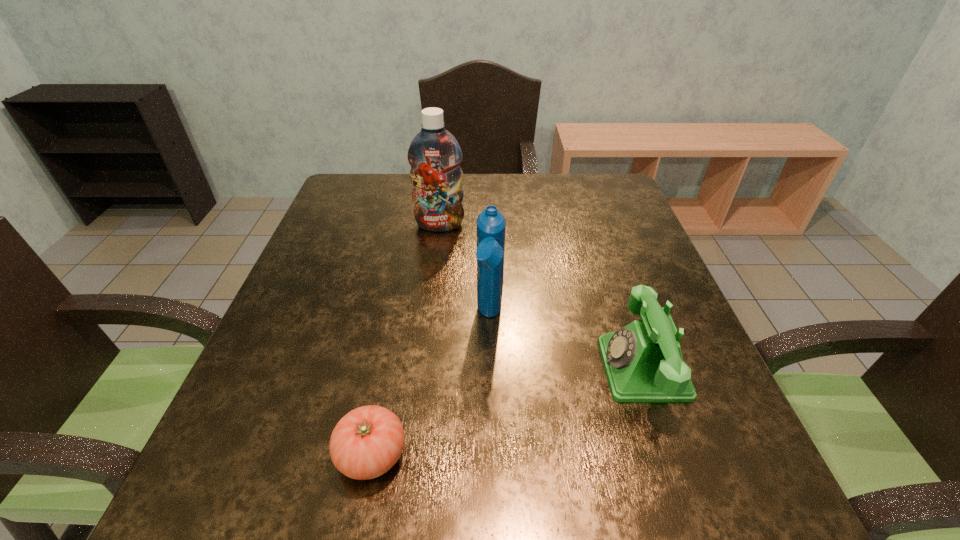
Where is `the left shampoo`? the left shampoo is located at coordinates (434, 154).

Where is `the taller shampoo`? The width and height of the screenshot is (960, 540). the taller shampoo is located at coordinates (434, 154).

Identify the location of the second tallest object. The image size is (960, 540). (491, 224).

You are a GUI agent. You are given a task and a screenshot of the screen. Output one action in this format:
    pyautogui.click(x=<x>, y=<y>)
    Task: Click on the shorter shampoo
    The height and width of the screenshot is (540, 960).
    Given the screenshot: What is the action you would take?
    pyautogui.click(x=491, y=224)

Find the location of a particular element. This screenshot has height=540, width=960. the rightmost object is located at coordinates (643, 362).

This screenshot has width=960, height=540. Identify the location of telephone. (643, 362).

At what (x,y) coordinates should I click in order to perform the action: click on tomato. Please return your answer as a coordinate pair (x, y). The image size is (960, 540). Looking at the image, I should click on (367, 442).

Where is `vacant space located on the front label of the farthest object`? vacant space located on the front label of the farthest object is located at coordinates (428, 322).

Identify the location of vacant space situated on the front of the third shortest object. This screenshot has width=960, height=540. (492, 407).

At what (x,y) coordinates should I click in order to perform the action: click on blank area located on the dial of the telephone. Please return your answer as a coordinate pair (x, y). Looking at the image, I should click on click(555, 369).